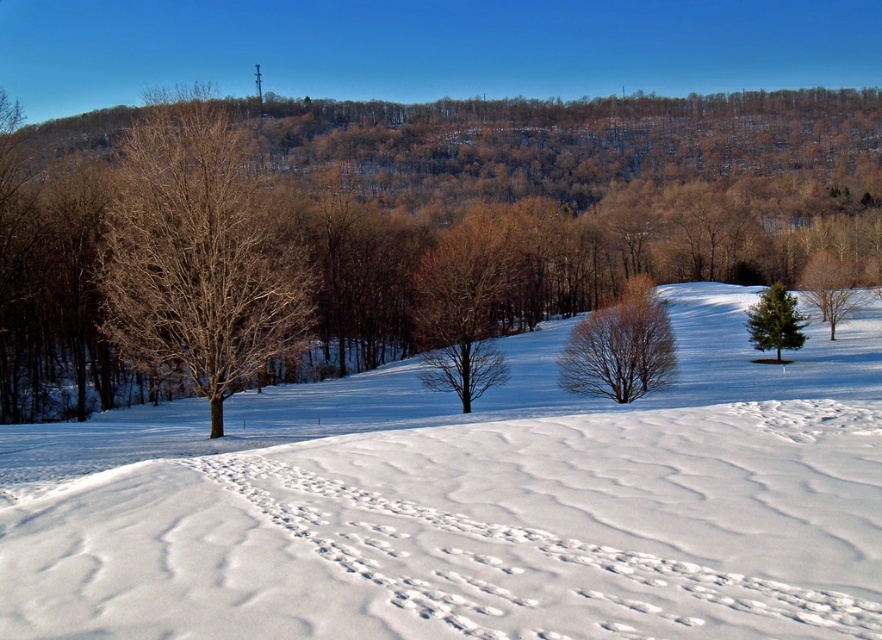
Can you confirm if brown leafless tree at center-left is taller than bare brown tree at center?

Correct, brown leafless tree at center-left is much taller as bare brown tree at center.

Does brown leafless tree at center-left appear on the left side of bare brown tree at center?

No, brown leafless tree at center-left is not to the left of bare brown tree at center.

Who is more distant from viewer, (258, 332) or (460, 230)?

The point (460, 230) is behind.

What are the coordinates of `brown leafless tree at center-left` in the screenshot? It's located at (543, 209).

Which is in front, point (278, 230) or point (589, 356)?

Point (589, 356) is in front.

Can you confirm if brown leafless tree at left is positioned to the left of brown textured tree at center?

Yes, brown leafless tree at left is to the left of brown textured tree at center.

The height and width of the screenshot is (640, 882). In order to click on brown leafless tree at left in this screenshot , I will do `click(199, 257)`.

Who is positioned more to the left, brown leafless tree at left or green textured pine tree at right?

brown leafless tree at left

Can you confirm if brown leafless tree at left is positioned to the left of green textured pine tree at right?

Correct, you'll find brown leafless tree at left to the left of green textured pine tree at right.

This screenshot has width=882, height=640. In order to click on brown leafless tree at left in this screenshot , I will do `click(199, 257)`.